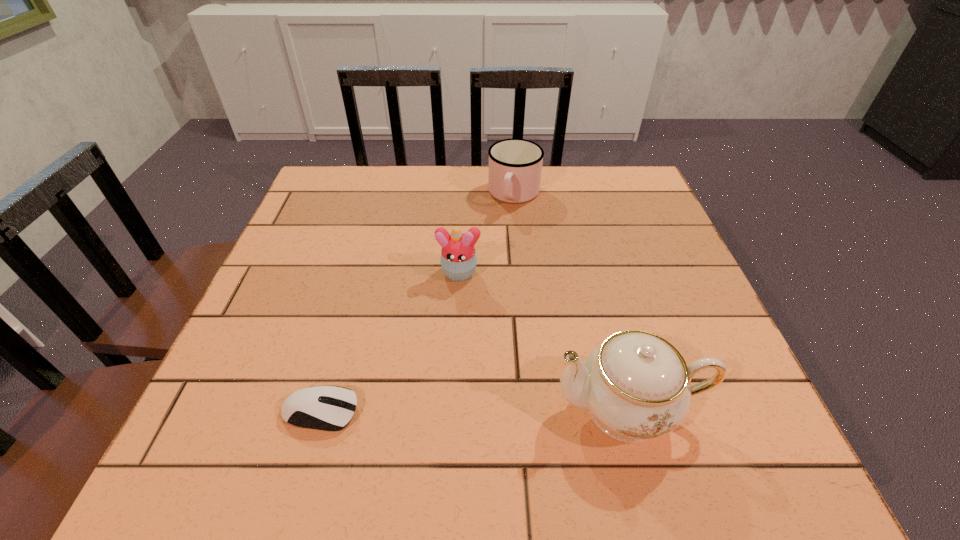
Locate an element on the screen. The height and width of the screenshot is (540, 960). free space between the shortest object and the tallest object is located at coordinates point(474,410).

Locate an element on the screen. This screenshot has width=960, height=540. free space between the chinaware and the farthest object is located at coordinates (571, 302).

You are a GUI agent. You are given a task and a screenshot of the screen. Output one action in this format:
    pyautogui.click(x=<x>, y=<y>)
    Task: Click on the free point between the cupcake and the mug
    The width and height of the screenshot is (960, 540).
    Given the screenshot: What is the action you would take?
    pyautogui.click(x=487, y=234)

This screenshot has height=540, width=960. Identify the location of vacant space in between the second object from left to right and the tallest object. (543, 341).

Locate an element on the screen. unoccupied area between the shortest object and the cupcake is located at coordinates (390, 342).

Where is `free point between the mug and the mouse`? free point between the mug and the mouse is located at coordinates (418, 303).

Identify the location of vacant space in between the farthest object and the second object from left to right. (487, 234).

Identify the location of free spot between the tallest object and the mug. The image size is (960, 540). (571, 302).

What are the coordinates of `free space between the farthest object and the second object from left to right` in the screenshot? It's located at (487, 234).

At what (x,y) coordinates should I click in order to perform the action: click on object that is the second closest one to the farthest object. Please return your answer as a coordinate pair (x, y). Looking at the image, I should click on (636, 386).